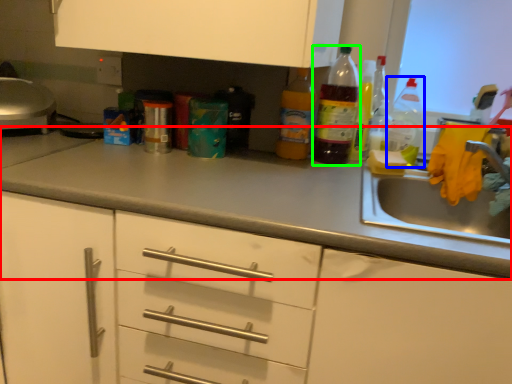
Question: Which object is positioned closest to countertop (highlighted by a red box)? Select from bottle (highlighted by a blue box) and bottle (highlighted by a green box).

Choices:
 (A) bottle
 (B) bottle

Answer: (B)